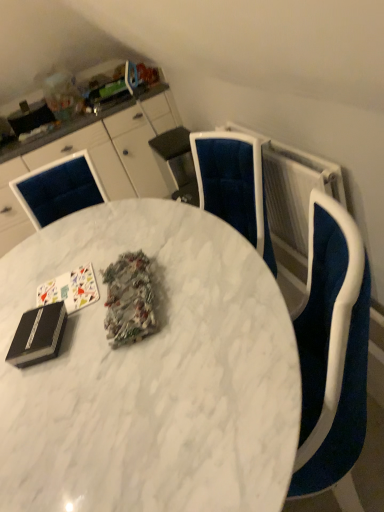
Where is `space that is in front of white matte card game at upper left`? The height and width of the screenshot is (512, 384). space that is in front of white matte card game at upper left is located at coordinates (69, 328).